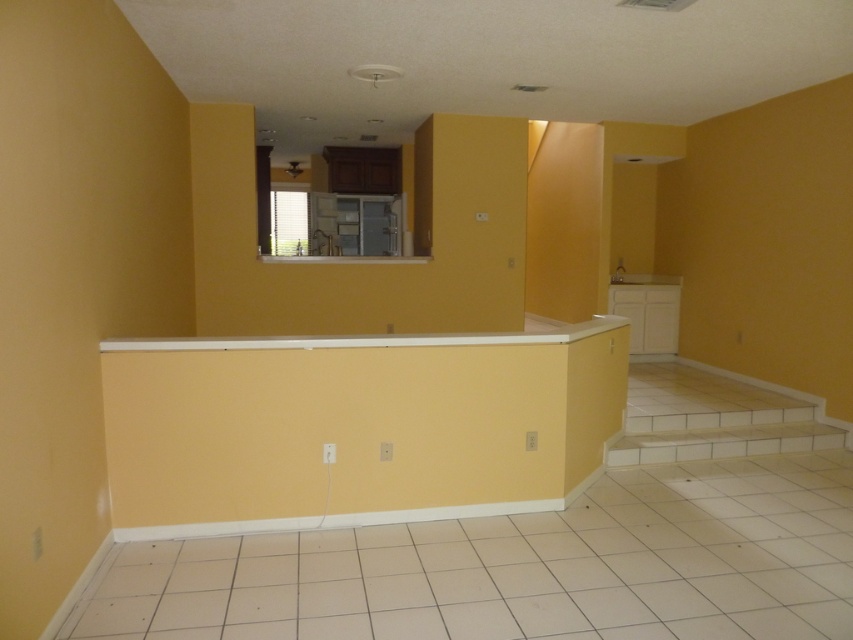
Can you confirm if white smooth trim at center is positioned to the left of white tile stairs at lower right?

Yes, white smooth trim at center is to the left of white tile stairs at lower right.

Does white smooth trim at center appear under white tile stairs at lower right?

No, white smooth trim at center is not below white tile stairs at lower right.

Between point (253, 488) and point (671, 369), which one is positioned behind?

The point (671, 369) is more distant.

This screenshot has width=853, height=640. In order to click on white smooth trim at center in this screenshot , I will do `click(355, 428)`.